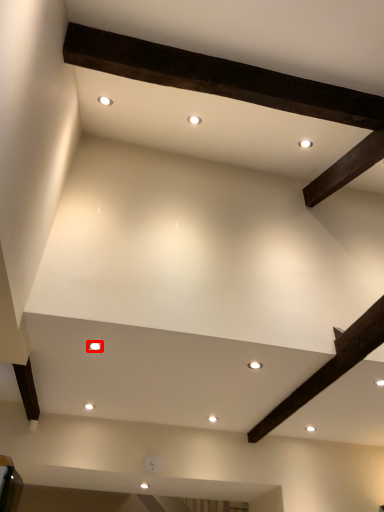
Question: In this image, where is lighting (annotated by the red box) located relative to lighting?

Choices:
 (A) left
 (B) right

Answer: (A)